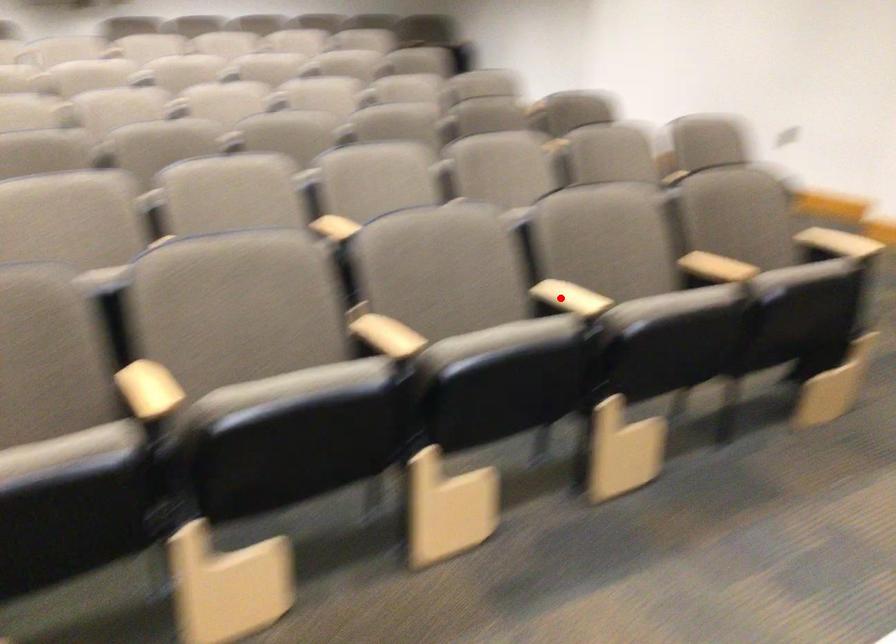
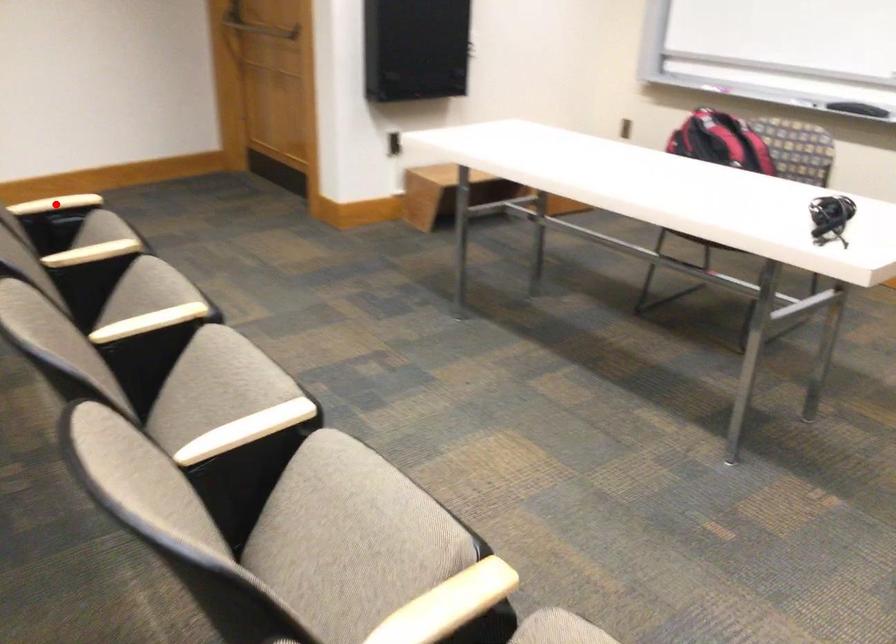
I am providing you with two images of the same scene from different viewpoints. A red point is marked on the first image and another point is marked on the second image. Is the marked point in image1 the same physical position as the marked point in image2?

No